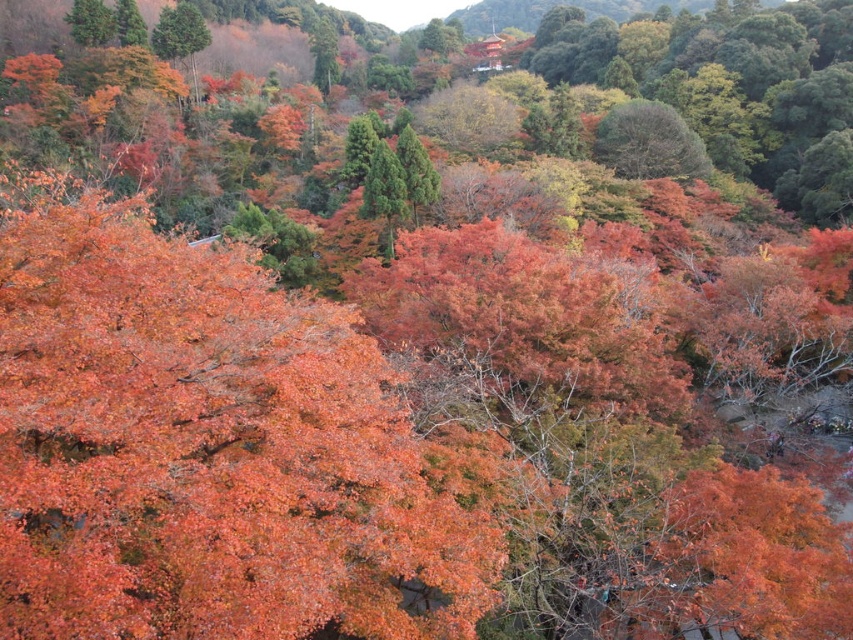
You are standing in the autumn landscape and want to walk from the point at coordinate point (54,499) to the point at coordinate point (660,140). Considering the terrain, which direction should you move to get closer to your destination?

Since point (54,499) is closer to the camera than point (660,140), you should move towards the background to reach your destination.

You are an artist planning to paint the autumn landscape. You want to ensure the shiny orange leaves at center and the dark green textured tree at upper center are proportionally accurate. Which object should you make wider in your painting?

The shiny orange leaves at center should be made wider in the painting since their width surpasses that of the dark green textured tree at upper center according to the description.

You are a hiker standing in the autumn landscape. You notice the shiny orange leaves at center and the dark green textured tree at upper center. Which object is closer to you?

The shiny orange leaves at center are closer to you because they are positioned in front of the dark green textured tree at upper center.